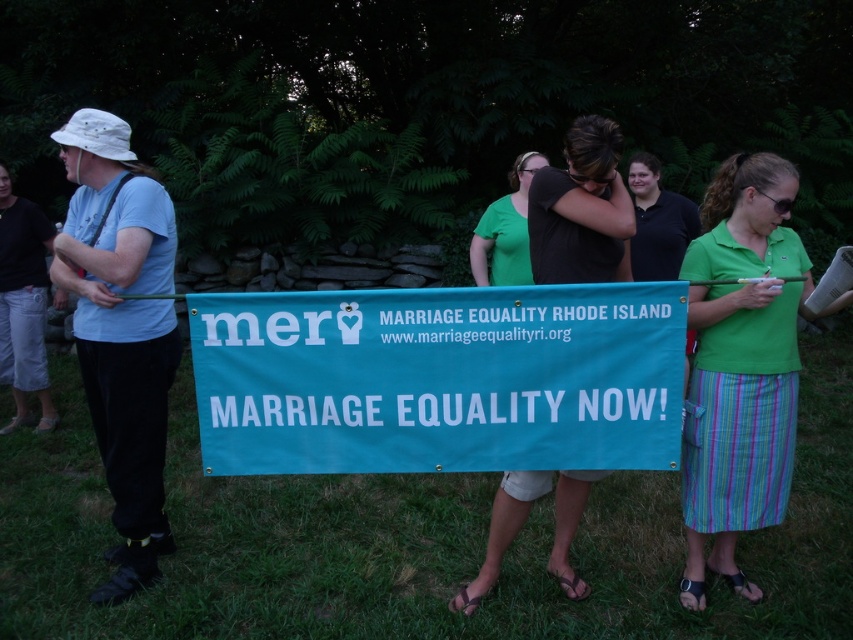
You are a photographer at the protest and want to capture the teal fabric banner at center and the dark brown hair at center in a single frame. Which object should you focus on first to ensure both are in the frame?

The teal fabric banner at center is taller than the dark brown hair at center, so you should focus on the teal fabric banner at center first to ensure both are in the frame.

You are a photographer at the protest and want to capture both the teal fabric banner at center and the dark brown hair at center in the same frame. Based on their positions, which object should you adjust your camera to focus on first to ensure both are in the shot?

The teal fabric banner at center is positioned on the left side of dark brown hair at center. To capture both in the same frame, focus on the dark brown hair at center first since it is on the right, allowing the banner to naturally fall into the left side of the frame.

You are a photographer trying to capture a clear shot of the teal fabric banner at center and the green cotton shirt at center. Since the banner is wider than the shirt, which object should you zoom in on to ensure both are visible in the frame?

The teal fabric banner at center is wider than the green cotton shirt at center, so you should zoom in on the green cotton shirt at center to ensure both are visible in the frame.